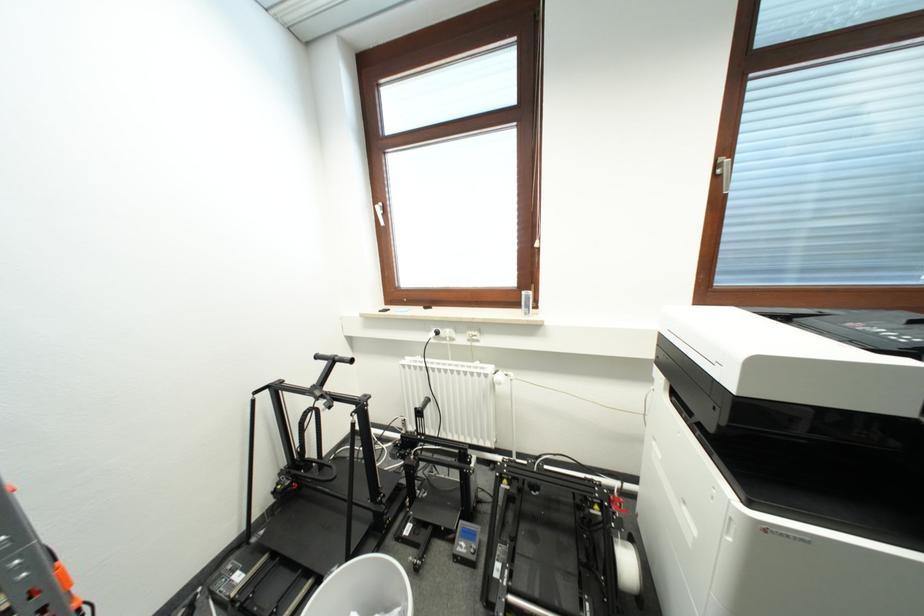
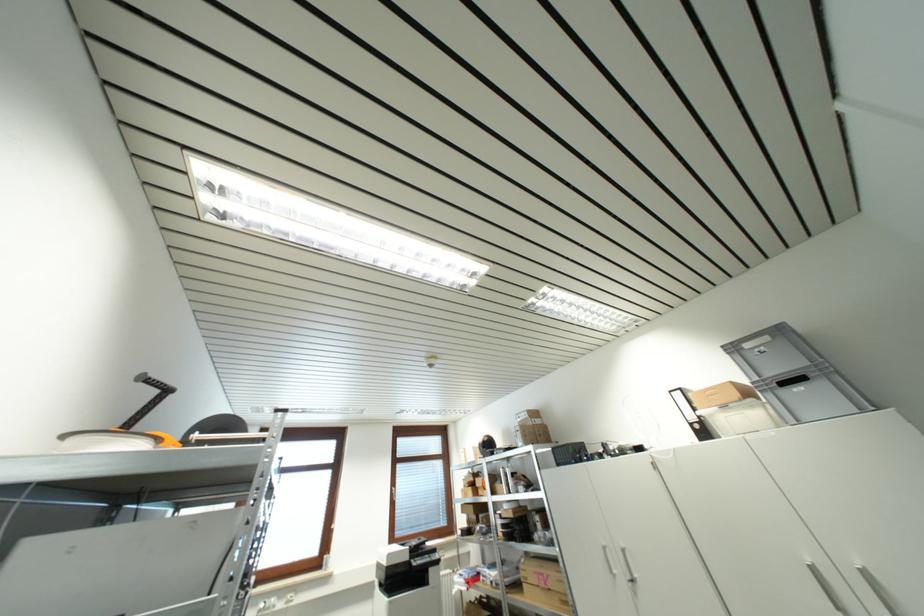
The point at (721, 169) is marked in the first image. Where is the corresponding point in the second image?

(395, 493)